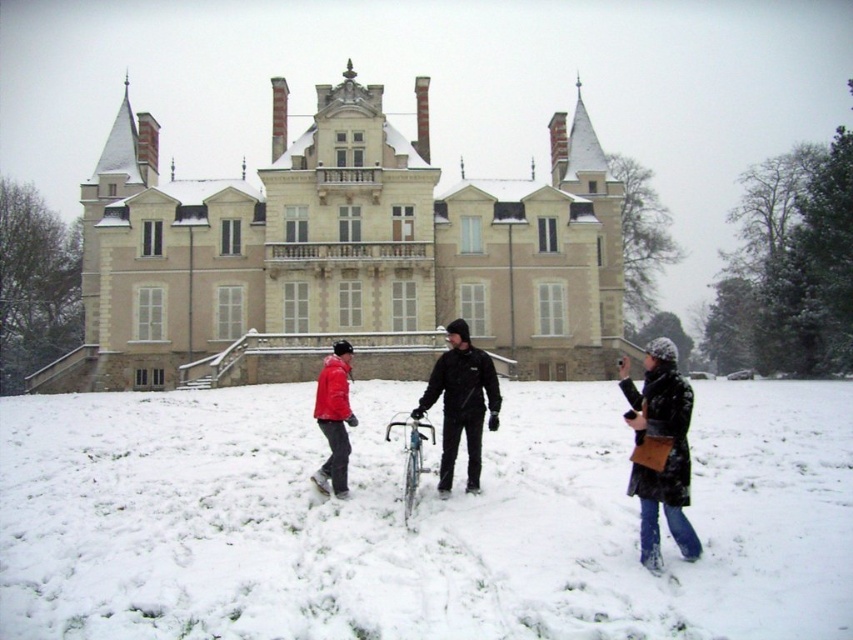
You are standing in front of the grand building and notice the white fluffy snow at center and the matte red jacket at center. From your perspective, which object is positioned to the right?

The white fluffy snow at center is to the right of the matte red jacket at center.

You are standing at the entrance of the chateau and want to take a photo of both the black textured coat at lower right and the matte red jacket at center. However, you can only focus on one person at a time. Which person should you focus on first to ensure the other is still in the frame?

You should focus on the matte red jacket at center first because the black textured coat at lower right is in front of it, so if you focus on the matte red jacket at center first, the black textured coat at lower right will still be in the frame behind it.

You are planning to take a group photo with the three people in the snowy scene. You need to ensure that everyone fits within the camera frame. Given that the black matte jacket at center and the matte red jacket at center are both in the shot, which jacket will appear larger in the photo?

The black matte jacket at center will appear larger in the photo because it is bigger than the matte red jacket at center according to the description.